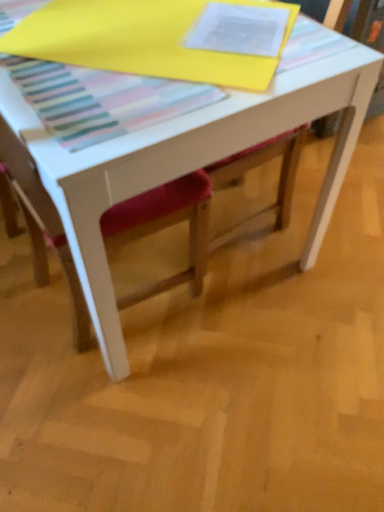
Question: From the image's perspective, is velvet red chair at center located above white matte table at center?

Choices:
 (A) no
 (B) yes

Answer: (A)

Question: Is white matte table at center completely or partially inside velvet red chair at center?

Choices:
 (A) yes
 (B) no

Answer: (B)

Question: Is velvet red chair at center positioned behind white matte table at center?

Choices:
 (A) no
 (B) yes

Answer: (A)

Question: Does velvet red chair at center have a greater height compared to white matte table at center?

Choices:
 (A) yes
 (B) no

Answer: (A)

Question: Is velvet red chair at center smaller than white matte table at center?

Choices:
 (A) no
 (B) yes

Answer: (B)

Question: Is velvet red chair at center facing away from white matte table at center?

Choices:
 (A) no
 (B) yes

Answer: (B)

Question: Is velvet red chair at center surrounded by white matte table at center?

Choices:
 (A) yes
 (B) no

Answer: (A)

Question: From a real-world perspective, is white matte table at center beneath velvet red chair at center?

Choices:
 (A) no
 (B) yes

Answer: (B)

Question: Is white matte table at center thinner than velvet red chair at center?

Choices:
 (A) yes
 (B) no

Answer: (B)

Question: Is white matte table at center to the right of velvet red chair at center from the viewer's perspective?

Choices:
 (A) no
 (B) yes

Answer: (B)

Question: From the image's perspective, is white matte table at center located beneath velvet red chair at center?

Choices:
 (A) yes
 (B) no

Answer: (B)

Question: Could you tell me if white matte table at center is turned towards velvet red chair at center?

Choices:
 (A) no
 (B) yes

Answer: (A)

Question: Considering the positions of white matte table at center and velvet red chair at center in the image, is white matte table at center wider or thinner than velvet red chair at center?

Choices:
 (A) thin
 (B) wide

Answer: (B)